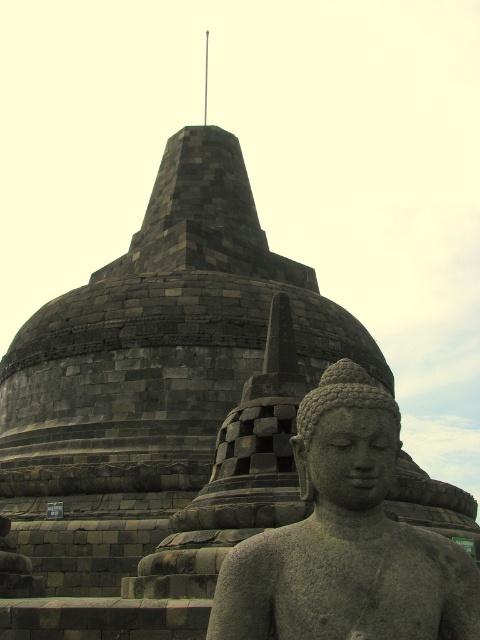
Between point (448, 568) and point (365, 486), which one is positioned in front?

Positioned in front is point (448, 568).

This screenshot has height=640, width=480. What do you see at coordinates (346, 540) in the screenshot? I see `gray stone statue at center` at bounding box center [346, 540].

The height and width of the screenshot is (640, 480). What are the coordinates of `gray stone statue at center` in the screenshot? It's located at (346, 540).